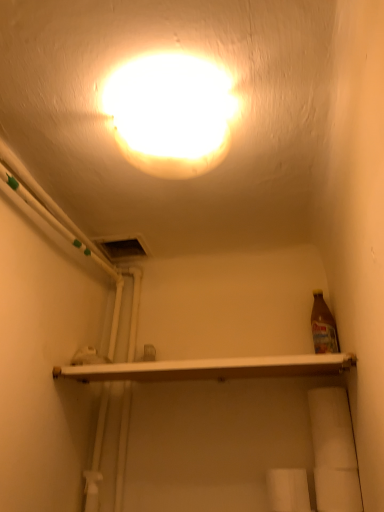
Question: Do you think white matte toilet paper at lower right, which is the 2th toilet paper in left-to-right order, is within white matte toilet paper at lower center, which is the 1th toilet paper from left to right, or outside of it?

Choices:
 (A) outside
 (B) inside

Answer: (A)

Question: Looking at the image, does white matte toilet paper at lower right, which is the 2th toilet paper in left-to-right order, seem bigger or smaller compared to white matte toilet paper at lower center, which is the 1th toilet paper from left to right?

Choices:
 (A) big
 (B) small

Answer: (B)

Question: Based on their relative distances, which object is nearer to the white glossy shelf at center?

Choices:
 (A) white matte toilet paper at lower right, the first toilet paper from the right
 (B) white matte toilet paper at lower center, positioned as the 2th toilet paper in right-to-left order
 (C) matte white light at upper center

Answer: (B)

Question: Which is nearer to the matte white light at upper center?

Choices:
 (A) white glossy shelf at center
 (B) white matte toilet paper at lower center, positioned as the 2th toilet paper in right-to-left order
 (C) white matte toilet paper at lower right, which is the 2th toilet paper in left-to-right order

Answer: (A)